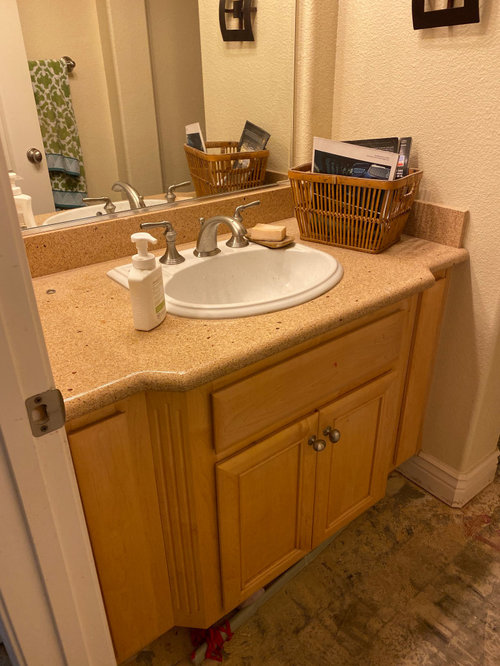
The image size is (500, 666). I want to click on baseboard, so coord(445,488).